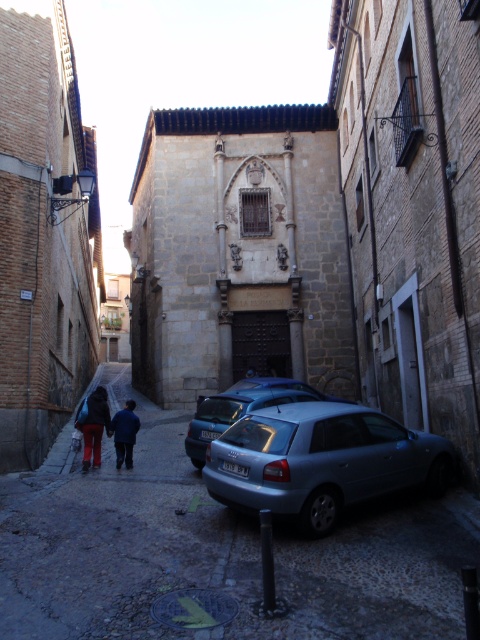
Which is above, dark blue jeans at lower left or blue fabric jacket at center?

blue fabric jacket at center is higher up.

Which is in front, point (81, 419) or point (122, 417)?

Point (81, 419)

Identify the location of dark blue jeans at lower left. (93, 424).

Between silver metallic car at center and metallic silver car at center, which one appears on the right side from the viewer's perspective?

metallic silver car at center

Does silver metallic car at center appear under metallic silver car at center?

Indeed, silver metallic car at center is positioned under metallic silver car at center.

Where is `silver metallic car at center`? silver metallic car at center is located at coordinates (215, 550).

Describe the element at coordinates (321, 460) in the screenshot. I see `satin silver car at center` at that location.

Who is more forward, [397,444] or [91,404]?

Point [397,444] is more forward.

Locate an element on the screen. The image size is (480, 640). satin silver car at center is located at coordinates (321, 460).

Locate an element on the screen. satin silver car at center is located at coordinates (321, 460).